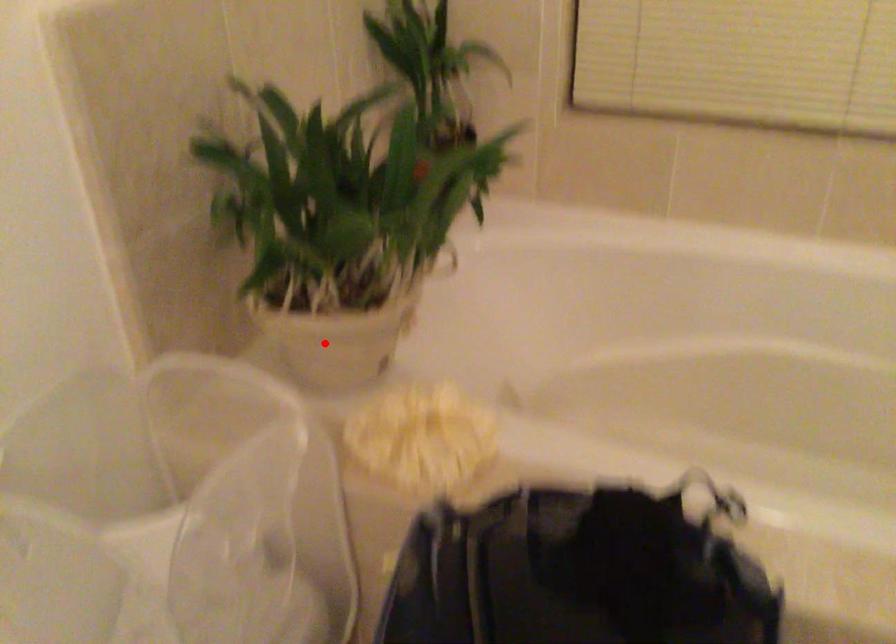
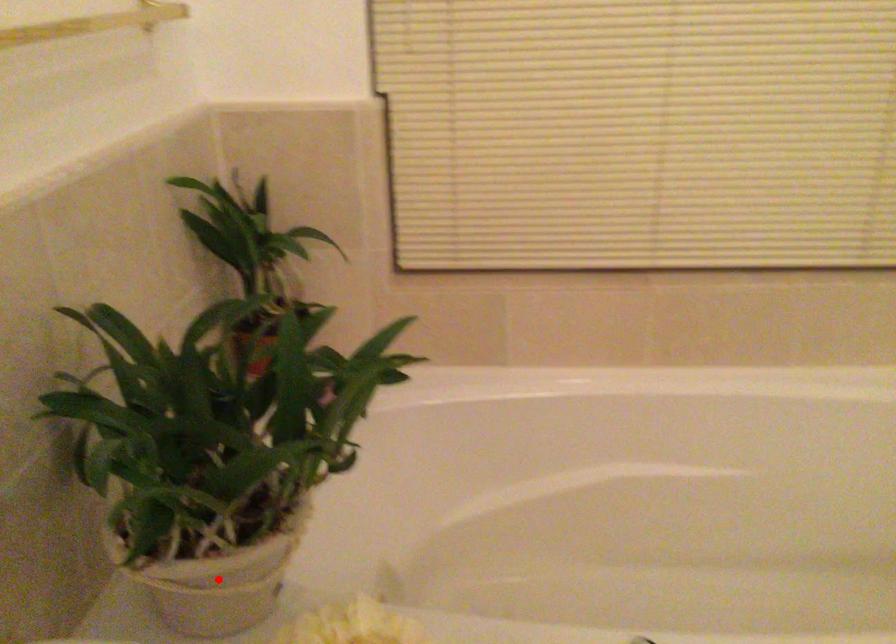
I am providing you with two images of the same scene from different viewpoints. A red point is marked on the first image and another point is marked on the second image. Do the highlighted points in image1 and image2 indicate the same real-world spot?

Yes